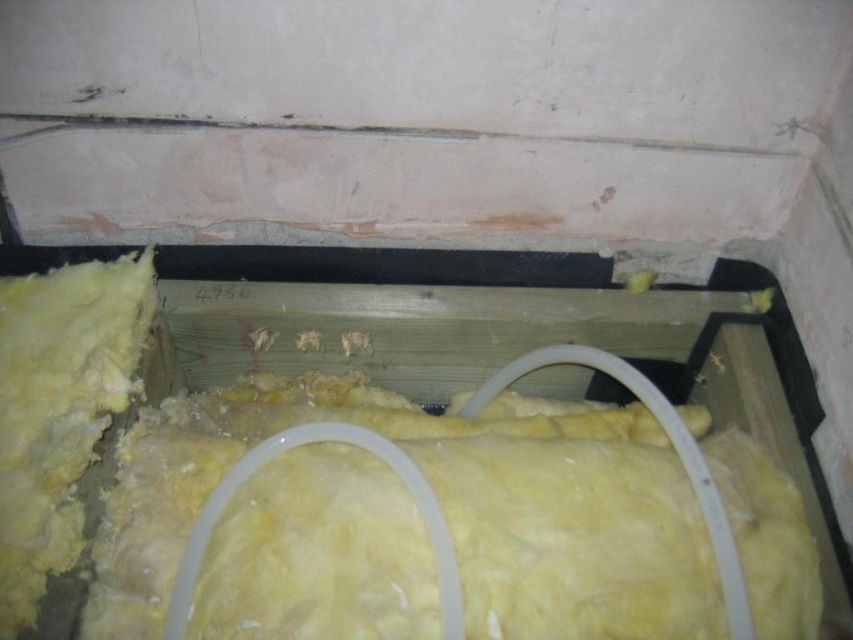
You are a construction worker inspecting the wall cavity. You need to locate the yellow fiberglass insulation at center. Where exactly is it positioned in the cavity?

The yellow fiberglass insulation at center is located at point (445,515) in the cavity.

You are a construction worker inspecting the wall cavity. You notice two types of insulation materials inside the cavity. Which one is closer to the front of the wall cavity between the yellow fiberglass insulation at center and the yellow wool insulation at left?

The yellow fiberglass insulation at center is closer to the front of the wall cavity since it is positioned in front of the yellow wool insulation at left.